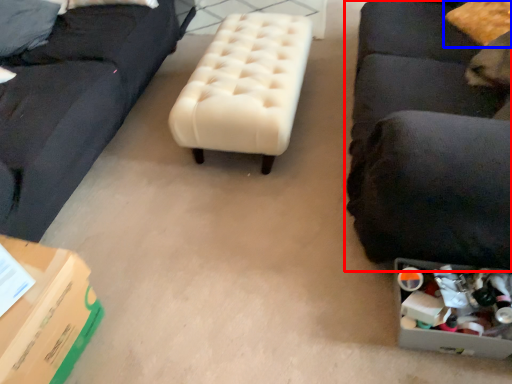
Question: Which object appears closest to the camera in this image, studio couch (highlighted by a red box) or pillow (highlighted by a blue box)?

Choices:
 (A) studio couch
 (B) pillow

Answer: (A)